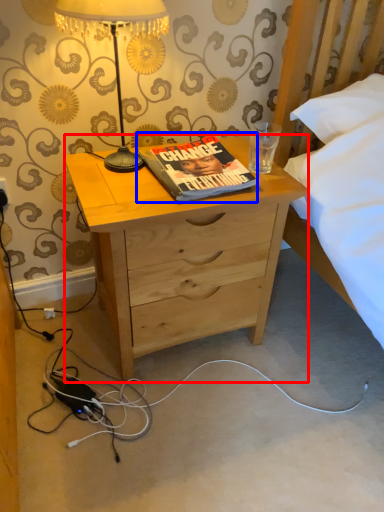
Question: Which point is further to the camera, desk (highlighted by a red box) or book (highlighted by a blue box)?

Choices:
 (A) desk
 (B) book

Answer: (B)